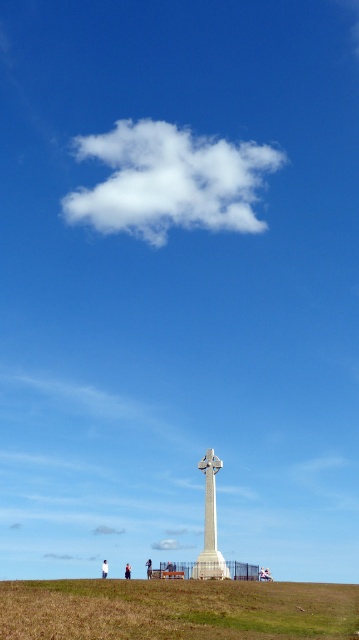
You are standing at the base of the large stone cross and want to greet two people located at the points labeled point (196,570) and point (126,568). Which person is closer to you?

Point (196,570) is in front of point (126,568), so the person at point (196,570) is closer to you.